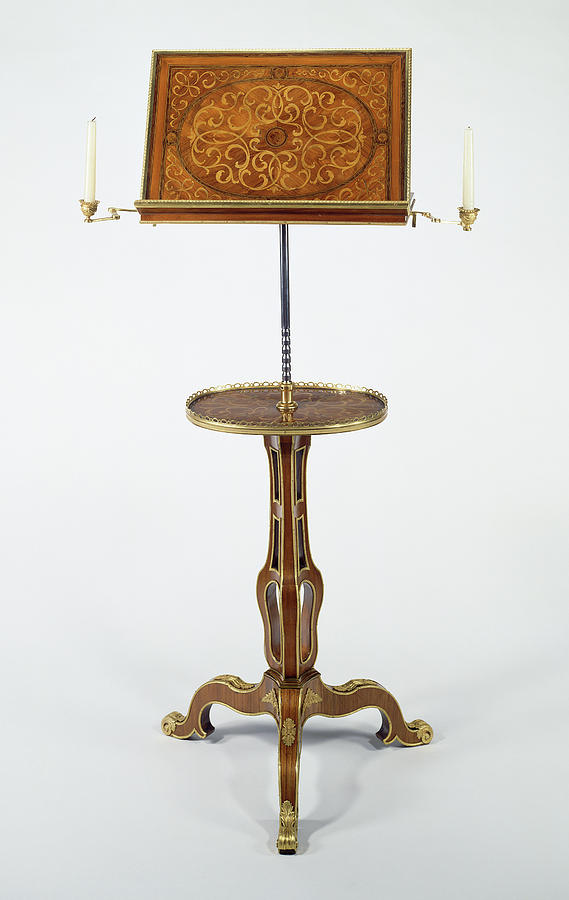
This screenshot has height=900, width=569. Identify the location of stand. (282, 254).